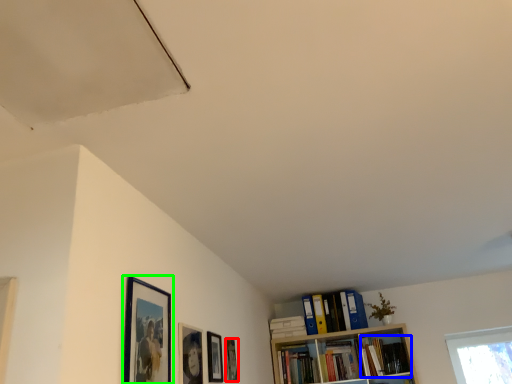
Question: Which is farther away from picture frame (highlighted by a red box)? book (highlighted by a blue box) or picture frame (highlighted by a green box)?

Choices:
 (A) book
 (B) picture frame

Answer: (A)